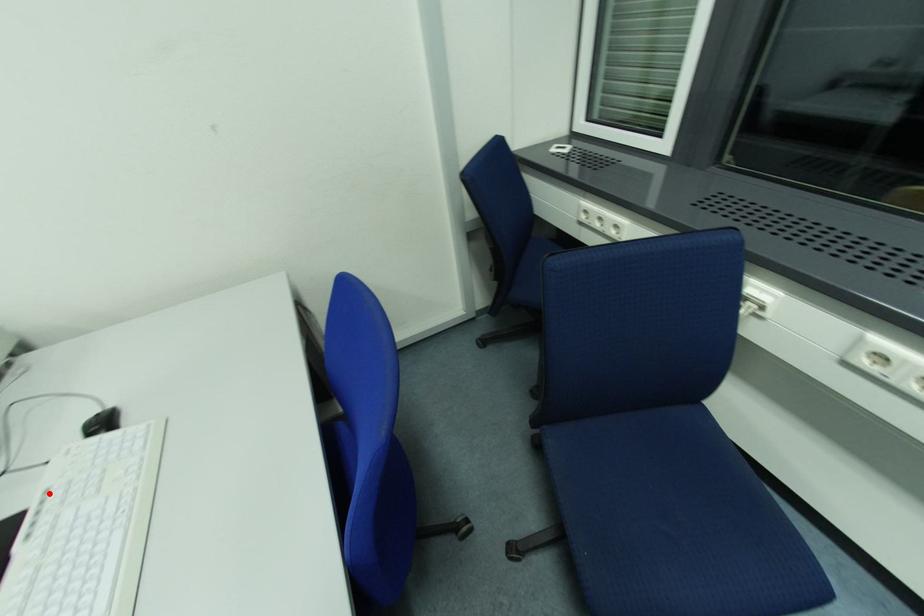
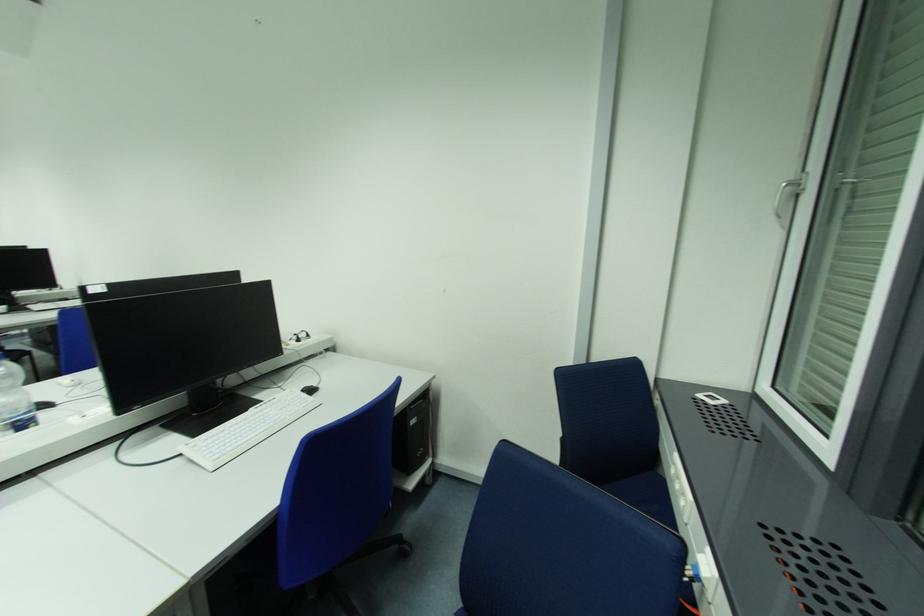
In the second image, find the point that corresponds to the highlighted location in the first image.

(276, 400)